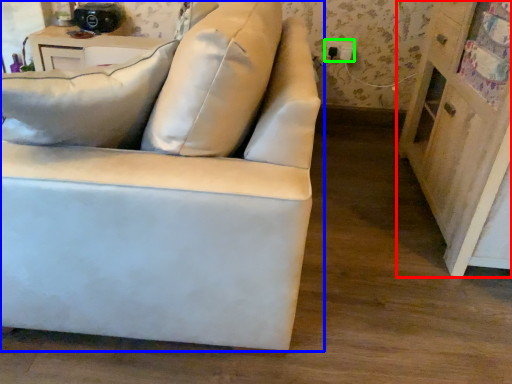
Question: Which object is positioned closest to dresser (highlighted by a red box)? Select from studio couch (highlighted by a blue box) and electric outlet (highlighted by a green box).

Choices:
 (A) studio couch
 (B) electric outlet

Answer: (A)